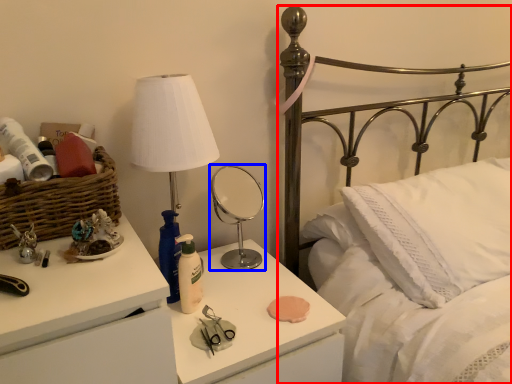
Question: Which object is closer to the camera taking this photo, bed (highlighted by a red box) or mirror (highlighted by a blue box)?

Choices:
 (A) bed
 (B) mirror

Answer: (A)